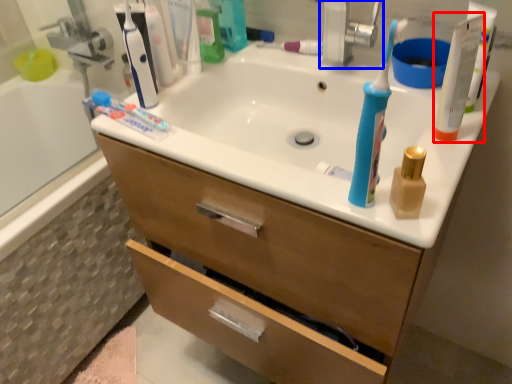
Question: Which of the following is the closest to the observer, toiletry (highlighted by a red box) or faucet (highlighted by a blue box)?

Choices:
 (A) toiletry
 (B) faucet

Answer: (A)